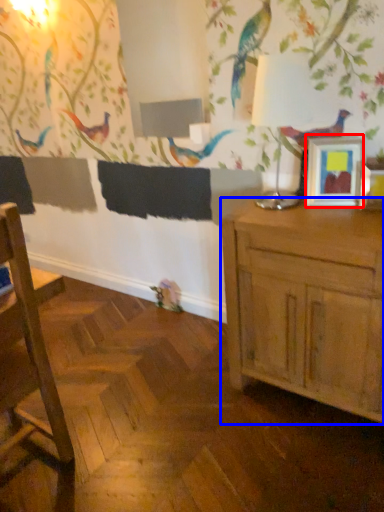
Question: Among these objects, which one is farthest to the camera, picture frame (highlighted by a red box) or cabinetry (highlighted by a blue box)?

Choices:
 (A) picture frame
 (B) cabinetry

Answer: (A)